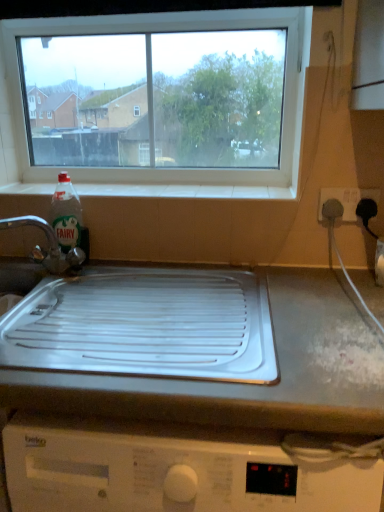
Describe the element at coordinates (134, 169) in the screenshot. I see `transparent glass window at upper center` at that location.

What do you see at coordinates (196, 349) in the screenshot?
I see `white plastic tray at center` at bounding box center [196, 349].

From the picture: Measure the distance between point (275, 288) and camera.

They are 1.02 meters apart.

Find the location of a particular element. The width and height of the screenshot is (384, 512). clear plastic bottle at left is located at coordinates (66, 214).

Measure the distance between clear plastic bottle at left and camera.

The distance of clear plastic bottle at left from camera is 3.75 feet.

Locate an element on the screen. The image size is (384, 512). white tile at upper center is located at coordinates (186, 191).

Is brushed metal tap at left situated inside white plastic tray at center or outside?

brushed metal tap at left is not inside white plastic tray at center, it's outside.

From the picture: Could you tell me if brushed metal tap at left is facing white plastic tray at center?

No.

Where is `tap located above the white plastic tray at center (from the image's perspective)`? tap located above the white plastic tray at center (from the image's perspective) is located at coordinates (49, 246).

Is there a large distance between brushed metal tap at left and white plastic tray at center?

They are positioned close to each other.

From the image's perspective, between brushed metal tap at left and clear plastic bottle at left, who is located below?

brushed metal tap at left.

Consider the image. Is brushed metal tap at left facing towards clear plastic bottle at left?

No.

Is point (5, 222) positioned after point (77, 206)?

That is True.

Based on the photo, is brushed metal tap at left directly adjacent to clear plastic bottle at left?

Yes, brushed metal tap at left is beside clear plastic bottle at left.

Consider the image. Is transparent glass window at upper center at the back of brushed metal tap at left?

brushed metal tap at left does not have its back to transparent glass window at upper center.

From a real-world perspective, which is physically above, brushed metal tap at left or transparent glass window at upper center?

In real-world perspective, transparent glass window at upper center is above.

Is brushed metal tap at left thinner than transparent glass window at upper center?

No, brushed metal tap at left is not thinner than transparent glass window at upper center.

Which object is closer to the camera taking this photo, brushed metal tap at left or transparent glass window at upper center?

brushed metal tap at left.

Where is `electric outlet lying above the clear plastic bottle at left (from the image's perspective)`? The width and height of the screenshot is (384, 512). electric outlet lying above the clear plastic bottle at left (from the image's perspective) is located at coordinates (341, 201).

From a real-world perspective, is clear plastic bottle at left positioned under white plastic socket at right based on gravity?

Indeed, from a real-world perspective, clear plastic bottle at left is positioned beneath white plastic socket at right.

Is clear plastic bottle at left shorter than white plastic socket at right?

No.

Can you tell me how much clear plastic bottle at left and white plastic socket at right differ in facing direction?

The angle between the facing direction of clear plastic bottle at left and the facing direction of white plastic socket at right is 0.472 degrees.

Based on their positions, is white tile at upper center located to the left or right of white plastic socket at right?

Clearly, white tile at upper center is on the left of white plastic socket at right in the image.

Is white tile at upper center closer to the viewer compared to white plastic socket at right?

No.

Looking at their sizes, would you say white tile at upper center is wider or thinner than white plastic socket at right?

Considering their sizes, white tile at upper center looks broader than white plastic socket at right.

From the image's perspective, between transparent glass window at upper center and clear plastic bottle at left, which one is located above?

transparent glass window at upper center, from the image's perspective.

Is transparent glass window at upper center facing away from clear plastic bottle at left?

No, transparent glass window at upper center is not facing the opposite direction of clear plastic bottle at left.

Would you say transparent glass window at upper center is a long distance from clear plastic bottle at left?

No, there isn't a large distance between transparent glass window at upper center and clear plastic bottle at left.

Is brushed metal tap at left to the right of white plastic socket at right from the viewer's perspective?

Incorrect, brushed metal tap at left is not on the right side of white plastic socket at right.

Which object is further away from the camera, brushed metal tap at left or white plastic socket at right?

white plastic socket at right is behind.

Choose the correct answer: Is brushed metal tap at left inside white plastic socket at right or outside it?

brushed metal tap at left is located beyond the bounds of white plastic socket at right.

Is brushed metal tap at left looking in the opposite direction of white plastic socket at right?

No, white plastic socket at right is not at the back of brushed metal tap at left.

In the image, there is a brushed metal tap at left. At what (x,y) coordinates should I click in order to perform the action: click on countertop below it (from the image's perspective). Please return your answer as a coordinate pair (x, y). This screenshot has width=384, height=512. Looking at the image, I should click on (196, 349).

Locate an element on the screen. The height and width of the screenshot is (512, 384). bottle located behind the brushed metal tap at left is located at coordinates (66, 214).

When comparing their distances from white tile at upper center, does transparent glass window at upper center or brushed metal tap at left seem closer?

Based on the image, transparent glass window at upper center appears to be nearer to white tile at upper center.

Estimate the real-world distances between objects in this image. Which object is further from clear plastic bottle at left, white tile at upper center or white plastic tray at center?

Based on the image, white plastic tray at center appears to be further to clear plastic bottle at left.

Which object lies nearer to the anchor point brushed metal tap at left, transparent glass window at upper center or clear plastic bottle at left?

clear plastic bottle at left.

When comparing their distances from white plastic tray at center, does transparent glass window at upper center or clear plastic bottle at left seem further?

clear plastic bottle at left is positioned further to the anchor white plastic tray at center.

When comparing their distances from brushed metal tap at left, does white tile at upper center or white plastic socket at right seem closer?

white tile at upper center is positioned closer to the anchor brushed metal tap at left.

Looking at this image, which object lies nearer to the anchor point brushed metal tap at left, white plastic socket at right or clear plastic bottle at left?

clear plastic bottle at left is positioned closer to the anchor brushed metal tap at left.

Looking at this image, based on their spatial positions, is brushed metal tap at left or white tile at upper center closer to transparent glass window at upper center?

white tile at upper center is positioned closer to the anchor transparent glass window at upper center.

From the image, which object appears to be farther from white plastic socket at right, clear plastic bottle at left or white tile at upper center?

clear plastic bottle at left.

You are a GUI agent. You are given a task and a screenshot of the screen. Output one action in this format:
    pyautogui.click(x=<x>, y=<y>)
    Task: Click on the window between white tile at upper center and white plastic socket at right from left to right
    The width and height of the screenshot is (384, 512).
    Given the screenshot: What is the action you would take?
    pyautogui.click(x=134, y=169)

Locate an element on the screen. This screenshot has width=384, height=512. window located between brushed metal tap at left and white plastic socket at right in the left-right direction is located at coordinates (134, 169).

Find the location of `electric outlet that lies between transparent glass window at upper center and white plastic tray at center from top to bottom`. electric outlet that lies between transparent glass window at upper center and white plastic tray at center from top to bottom is located at coordinates (341, 201).

You are a GUI agent. You are given a task and a screenshot of the screen. Output one action in this format:
    pyautogui.click(x=<x>, y=<y>)
    Task: Click on the window sill between brushed metal tap at left and white plastic socket at right
    Image resolution: width=384 pixels, height=512 pixels.
    Given the screenshot: What is the action you would take?
    pyautogui.click(x=186, y=191)